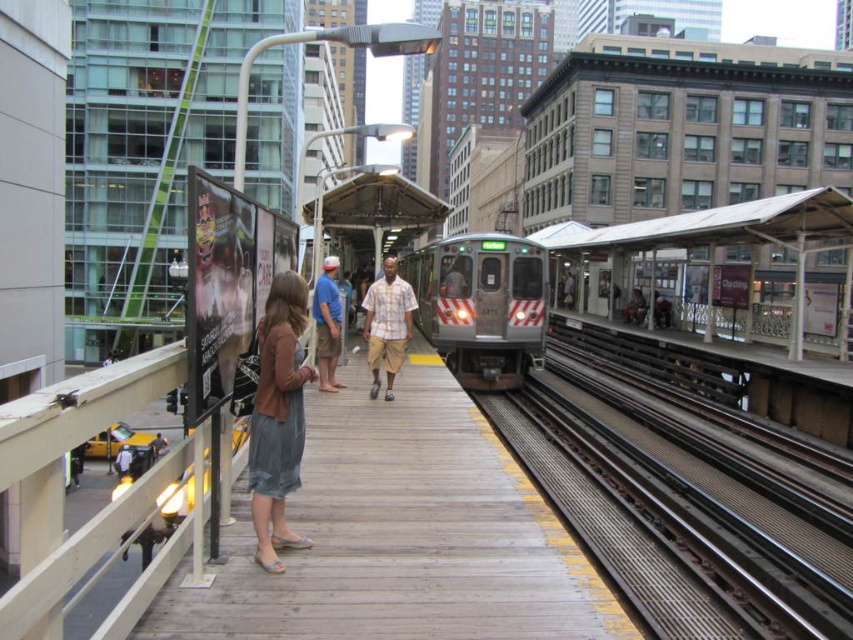
Is point (283, 529) farther from camera compared to point (326, 368)?

No, it is in front of (326, 368).

Consider the image. Between denim skirt at center and blue cotton shirt at center, which one appears on the left side from the viewer's perspective?

Positioned to the left is blue cotton shirt at center.

Which is behind, point (265, 525) or point (335, 384)?

The point (335, 384) is behind.

The image size is (853, 640). I want to click on denim skirt at center, so point(277,419).

Does metal/textured train track at right have a greater height compared to plaid cotton shirt at center?

No.

This screenshot has height=640, width=853. I want to click on metal/textured train track at right, so click(x=663, y=531).

This screenshot has height=640, width=853. In order to click on metal/textured train track at right in this screenshot , I will do `click(663, 531)`.

Is point (605, 528) closer to viewer compared to point (323, 289)?

Yes, it is in front of point (323, 289).

Between point (766, 609) and point (331, 316), which one is positioned behind?

Point (331, 316)

Image resolution: width=853 pixels, height=640 pixels. Identify the location of metal/textured train track at right. (663, 531).